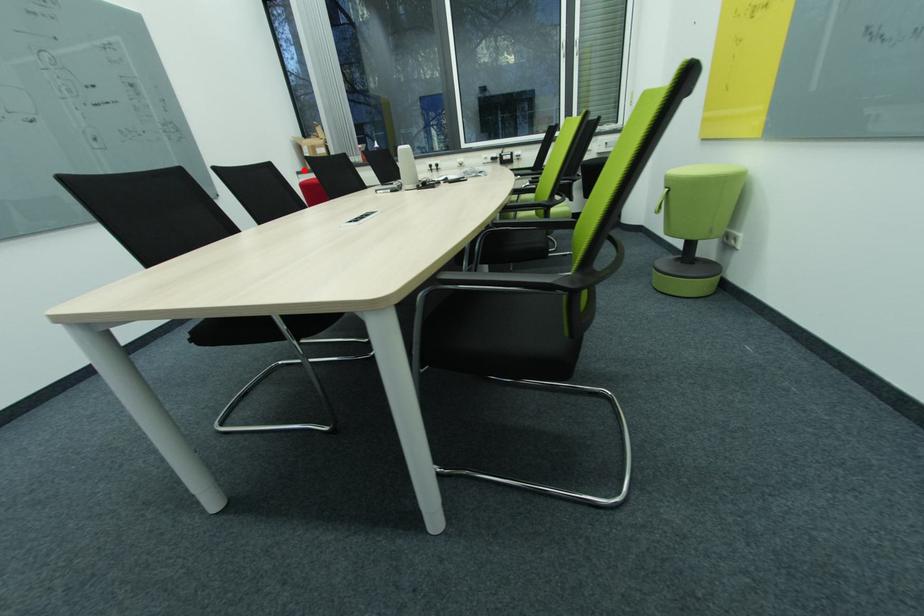
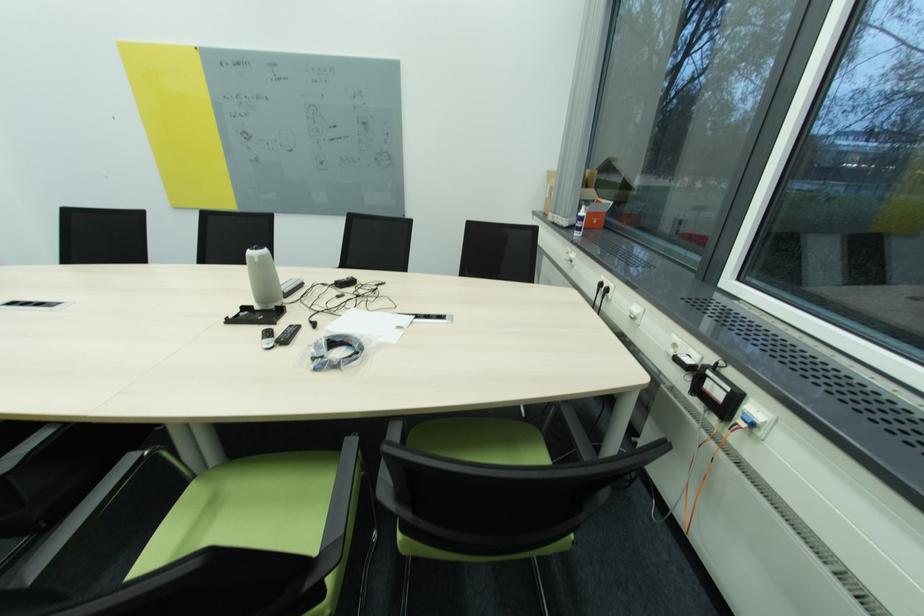
Question: I am providing you with two images of the same scene from different viewpoints. Image1 has a red point marked. In image2, the corresponding 3D location appears at what relative position? Reply with the corresponding letter.

Choices:
 (A) Closer
 (B) Farther

Answer: (B)